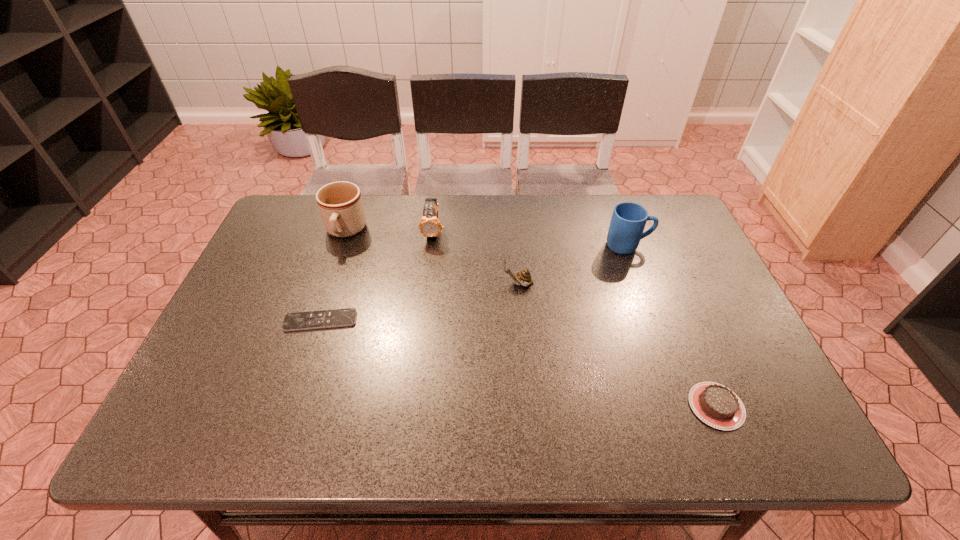
I want to click on mug that is positioned at the right edge, so click(628, 220).

At what (x,y) coordinates should I click in order to perform the action: click on chocolate cake that is at the right edge. Please return your answer as a coordinate pair (x, y). The image size is (960, 540). Looking at the image, I should click on (716, 405).

Locate an element on the screen. object that is at the far right corner is located at coordinates (628, 220).

In order to click on object that is at the near right corner in this screenshot , I will do `click(716, 405)`.

Image resolution: width=960 pixels, height=540 pixels. Identify the location of vacant area at the far edge of the desktop. 572,198.

At what (x,y) coordinates should I click in order to perform the action: click on free space at the near edge of the desktop. Please return your answer as a coordinate pair (x, y). The image size is (960, 540). Looking at the image, I should click on (431, 433).

In the image, there is a desktop. Where is `free space at the left edge`? The width and height of the screenshot is (960, 540). free space at the left edge is located at coordinates (264, 265).

Identify the location of free space at the right edge of the desktop. This screenshot has height=540, width=960. (740, 343).

Find the location of a particular element. The height and width of the screenshot is (540, 960). free space at the near left corner of the desktop is located at coordinates (224, 441).

I want to click on vacant space at the far right corner of the desktop, so click(x=645, y=230).